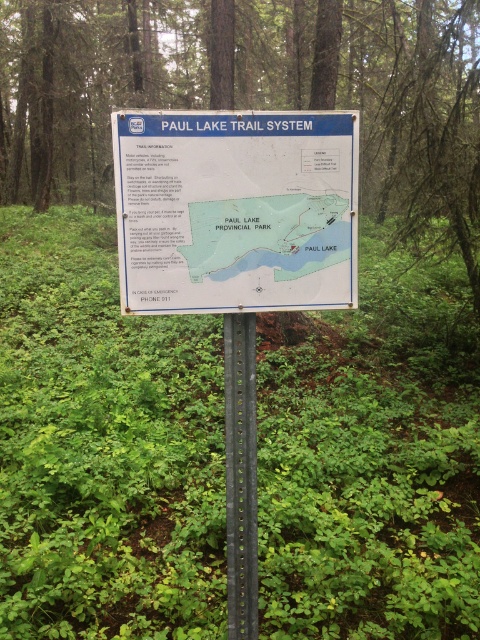
Does green leafy tree at center have a smaller size compared to white paper sign at center?

No.

Measure the distance between green leafy tree at center and white paper sign at center.

The distance of green leafy tree at center from white paper sign at center is 8.48 meters.

Is point (465, 204) closer to camera compared to point (241, 232)?

No, it is not.

Locate an element on the screen. This screenshot has width=480, height=640. green leafy tree at center is located at coordinates (383, 100).

Who is taller, white paper sign at center or white paper map at center?

white paper sign at center

Who is positioned more to the right, white paper sign at center or white paper map at center?

white paper map at center

Locate an element on the screen. The width and height of the screenshot is (480, 640). white paper sign at center is located at coordinates (236, 211).

Does white paper map at center have a lesser height compared to black metal pole at center?

Yes.

Who is shorter, white paper map at center or black metal pole at center?

white paper map at center is shorter.

At what (x,y) coordinates should I click in order to perform the action: click on white paper map at center. Please return your answer as a coordinate pair (x, y). This screenshot has width=480, height=640. Looking at the image, I should click on (266, 236).